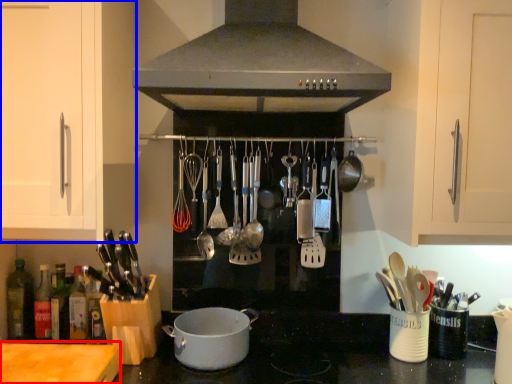
Question: Among these objects, which one is nearest to the camera, counter top (highlighted by a red box) or cabinetry (highlighted by a blue box)?

Choices:
 (A) counter top
 (B) cabinetry

Answer: (A)